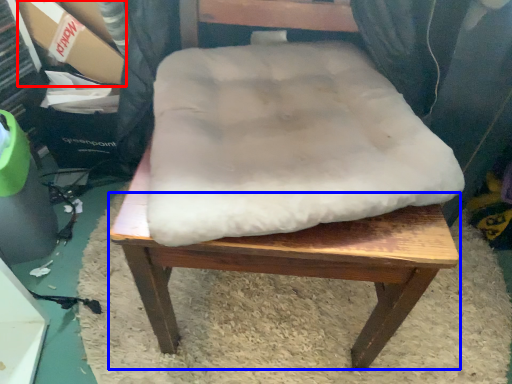
Question: Which object is further to the camera taking this photo, cardboard box (highlighted by a red box) or step stool (highlighted by a blue box)?

Choices:
 (A) cardboard box
 (B) step stool

Answer: (A)